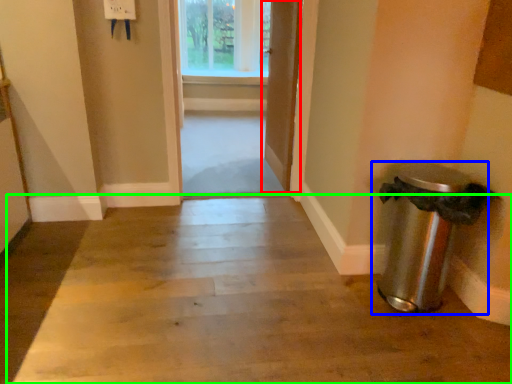
Question: Based on their relative distances, which object is nearer to door (highlighted by a red box)? Choose from waste container (highlighted by a blue box) and path (highlighted by a green box).

Choices:
 (A) waste container
 (B) path

Answer: (A)